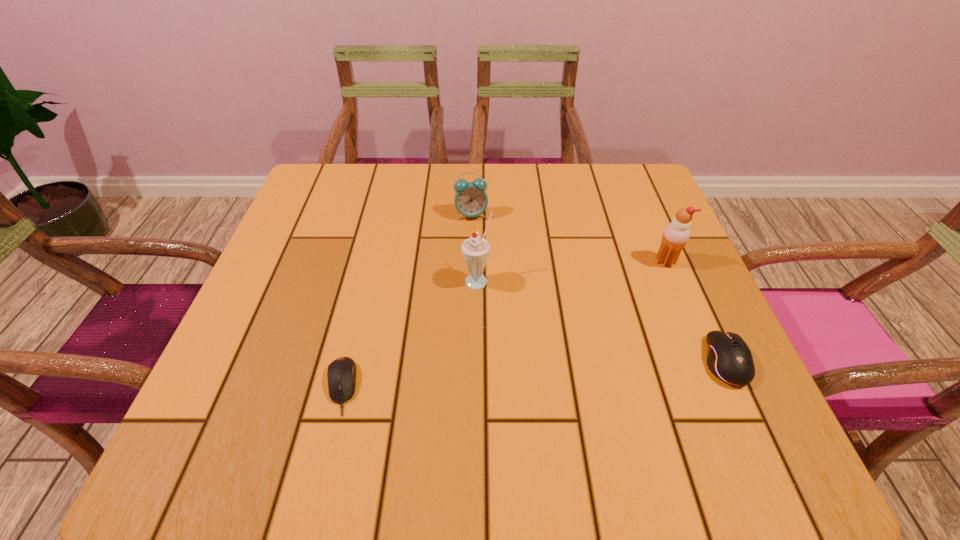
This screenshot has height=540, width=960. Find the location of `vacant spot on the desktop that is between the shortest object and the taller computer mouse and is positioned on the straw side of the milkshake`. vacant spot on the desktop that is between the shortest object and the taller computer mouse and is positioned on the straw side of the milkshake is located at coordinates point(557,373).

You are a GUI agent. You are given a task and a screenshot of the screen. Output one action in this format:
    pyautogui.click(x=<x>, y=<y>)
    Task: Click on the free space on the desktop that is between the shortest object and the fourth tallest object and is positioned at the front with a straw on the icecream
    Image resolution: width=960 pixels, height=540 pixels.
    Given the screenshot: What is the action you would take?
    pyautogui.click(x=523, y=375)

The image size is (960, 540). I want to click on vacant space on the desktop that is between the shortest object and the second shortest object and is positioned on the face of the farthest object, so click(x=546, y=373).